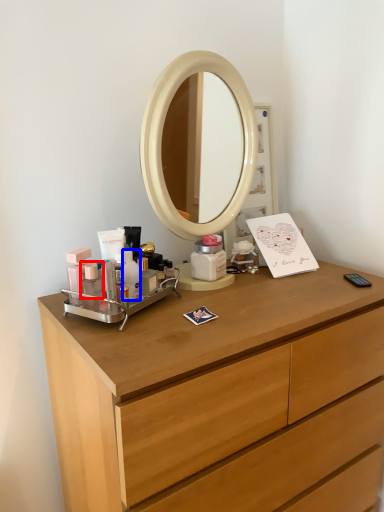
Question: Which object appears farthest to the camera in this image, toiletry (highlighted by a red box) or toiletry (highlighted by a blue box)?

Choices:
 (A) toiletry
 (B) toiletry

Answer: (B)